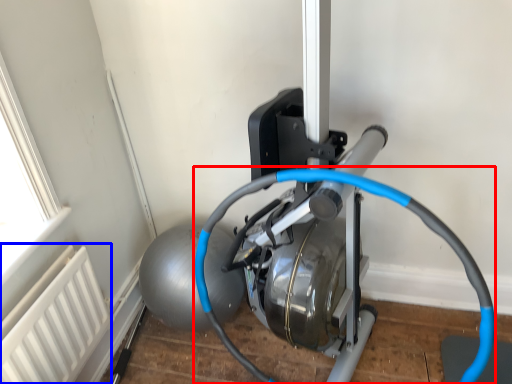
Question: Which point is further to the camera, wire (highlighted by a red box) or radiator (highlighted by a blue box)?

Choices:
 (A) wire
 (B) radiator

Answer: (B)